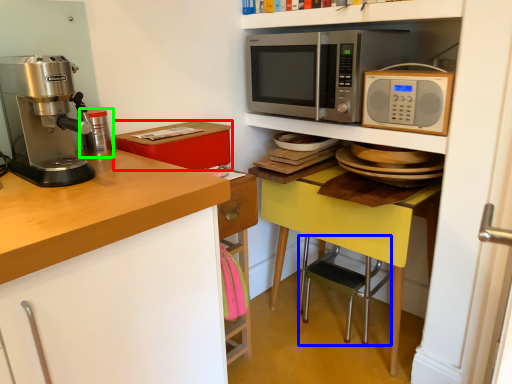
Question: Which object is positioned farthest from box (highlighted by a red box)? Select from step stool (highlighted by a blue box) and appliance (highlighted by a green box).

Choices:
 (A) step stool
 (B) appliance

Answer: (A)